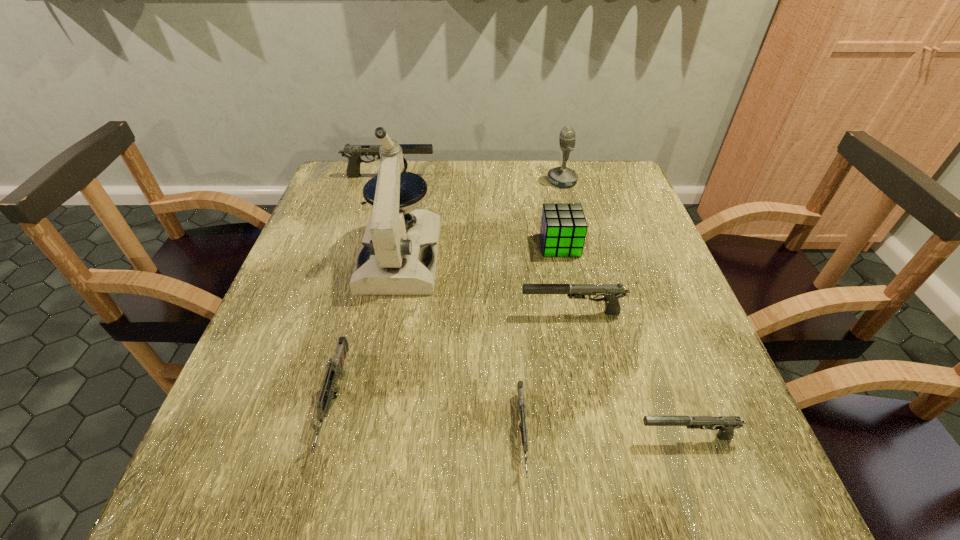
The image size is (960, 540). What are the coordinates of `the shortest gun` in the screenshot? It's located at (524, 433).

Where is `free space located 0.290m at the eyepiece of the tallest object`? This screenshot has height=540, width=960. free space located 0.290m at the eyepiece of the tallest object is located at coordinates pos(369,417).

The image size is (960, 540). In order to click on free location located 0.050m on the front-facing side of the seventh shortest object in this screenshot , I will do `click(530, 181)`.

Image resolution: width=960 pixels, height=540 pixels. Identify the location of vacant space located 0.180m on the front-facing side of the seventh shortest object. (486, 181).

Image resolution: width=960 pixels, height=540 pixels. In order to click on blank area located 0.280m on the front-facing side of the seventh shortest object in this screenshot , I will do `click(451, 181)`.

Locate an element on the screen. The image size is (960, 540). blank space located at the muzzle end of the leftmost gray gun is located at coordinates point(505,176).

The height and width of the screenshot is (540, 960). Find the location of `vacant position located 0.180m on the right of the red cube`. vacant position located 0.180m on the right of the red cube is located at coordinates (652, 245).

Locate an element on the screen. blank space located at the muzzle end of the fourth nearest gun is located at coordinates (497, 313).

Where is `free region located at the muzzle end of the fourth nearest gun`? The width and height of the screenshot is (960, 540). free region located at the muzzle end of the fourth nearest gun is located at coordinates (358, 313).

Find the location of `free point located 0.180m at the muzzle end of the fourth nearest gun`. free point located 0.180m at the muzzle end of the fourth nearest gun is located at coordinates (435, 313).